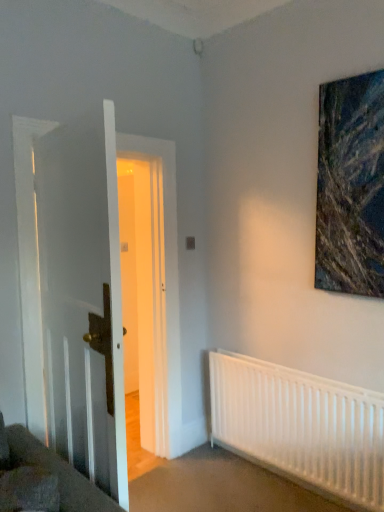
Question: Does textured canvas painting at upper right have a smaller size compared to white matte radiator at lower right?

Choices:
 (A) yes
 (B) no

Answer: (A)

Question: Is white matte radiator at lower right surrounded by textured canvas painting at upper right?

Choices:
 (A) yes
 (B) no

Answer: (B)

Question: Is textured canvas painting at upper right shorter than white matte radiator at lower right?

Choices:
 (A) yes
 (B) no

Answer: (B)

Question: From the image's perspective, is textured canvas painting at upper right beneath white matte radiator at lower right?

Choices:
 (A) no
 (B) yes

Answer: (A)

Question: From a real-world perspective, is textured canvas painting at upper right under white matte radiator at lower right?

Choices:
 (A) yes
 (B) no

Answer: (B)

Question: Is point (220, 425) positioned closer to the camera than point (72, 421)?

Choices:
 (A) closer
 (B) farther

Answer: (B)

Question: From the image's perspective, relative to white wooden door at left, is white matte radiator at lower right above or below?

Choices:
 (A) below
 (B) above

Answer: (A)

Question: Is white matte radiator at lower right to the left or to the right of white wooden door at left in the image?

Choices:
 (A) right
 (B) left

Answer: (A)

Question: From their relative heights in the image, would you say white matte radiator at lower right is taller or shorter than white wooden door at left?

Choices:
 (A) tall
 (B) short

Answer: (B)

Question: From a real-world perspective, is white wooden door at left physically located above or below textured canvas painting at upper right?

Choices:
 (A) above
 (B) below

Answer: (B)

Question: Is white wooden door at left bigger or smaller than textured canvas painting at upper right?

Choices:
 (A) big
 (B) small

Answer: (A)

Question: Relative to textured canvas painting at upper right, is white wooden door at left in front or behind?

Choices:
 (A) front
 (B) behind

Answer: (A)

Question: Considering the positions of white wooden door at left and textured canvas painting at upper right in the image, is white wooden door at left taller or shorter than textured canvas painting at upper right?

Choices:
 (A) tall
 (B) short

Answer: (A)

Question: Does point (331, 116) appear closer or farther from the camera than point (339, 420)?

Choices:
 (A) farther
 (B) closer

Answer: (A)

Question: Is textured canvas painting at upper right inside the boundaries of white matte radiator at lower right, or outside?

Choices:
 (A) inside
 (B) outside

Answer: (B)